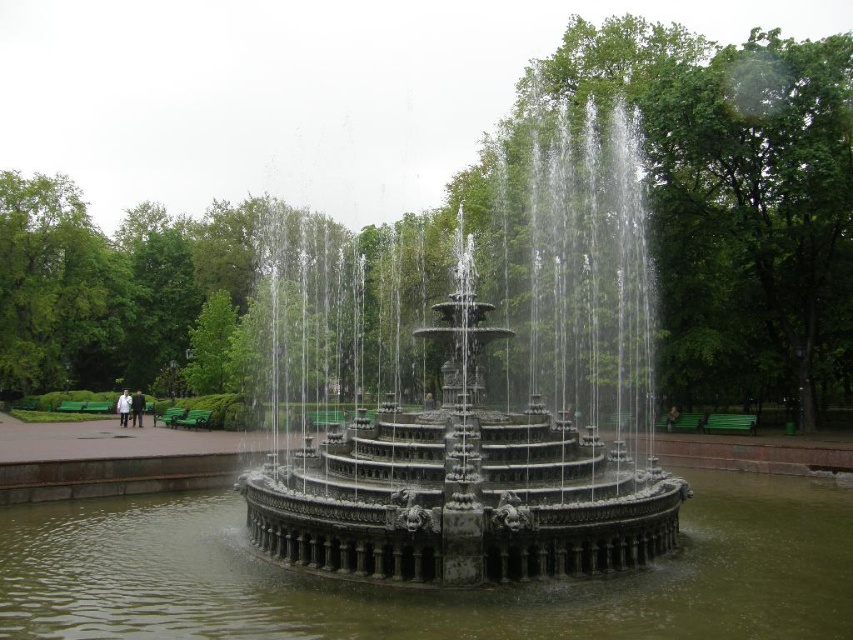
Question: Can you confirm if polished stone fountain at center is positioned below greenish water at center?

Choices:
 (A) yes
 (B) no

Answer: (B)

Question: Among these objects, which one is farthest from the camera?

Choices:
 (A) polished stone fountain at center
 (B) greenish water at center

Answer: (A)

Question: Is polished stone fountain at center behind greenish water at center?

Choices:
 (A) no
 (B) yes

Answer: (B)

Question: Which point is farther from the camera taking this photo?

Choices:
 (A) (566, 147)
 (B) (780, 621)

Answer: (A)

Question: Observing the image, what is the correct spatial positioning of polished stone fountain at center in reference to greenish water at center?

Choices:
 (A) above
 (B) below

Answer: (A)